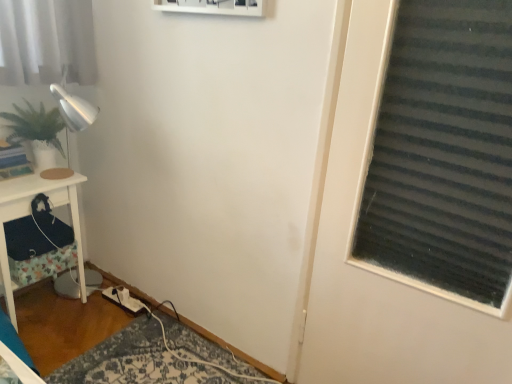
At what (x,y) coordinates should I click in order to perform the action: click on vacant region to the right of white fabric extension cord at lower left. Please return your answer as a coordinate pair (x, y). Looking at the image, I should click on (153, 318).